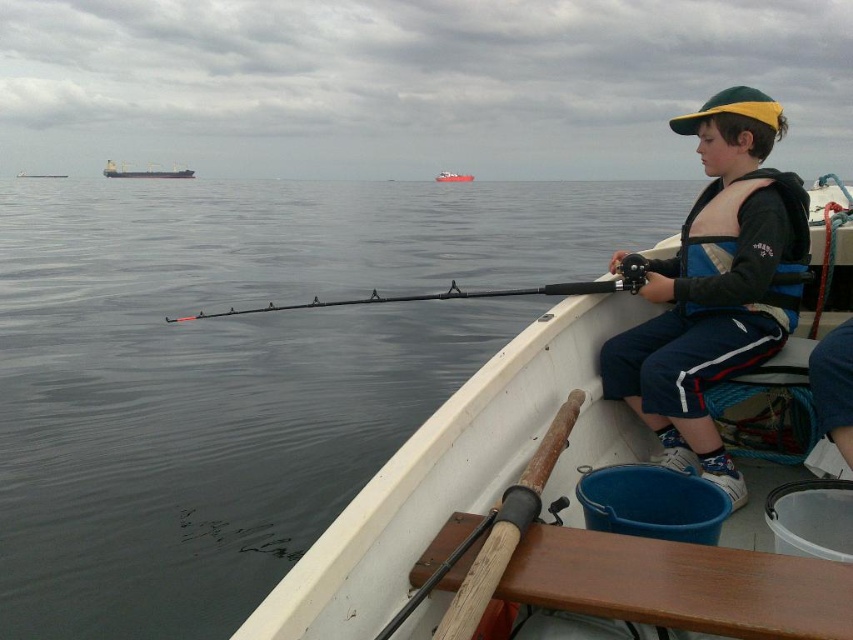
You are standing on the deck of a ship and see a point marked at coordinates point [163,292]. If you want to throw a lifebuoy to that point, and the lifebuoy can travel 10 meters, will it reach the point?

The point [163,292] is 11.82 meters away from the viewer. Since the lifebuoy can only travel 10 meters, it will not reach the point.

In the scene shown: You are a sailor on the metallic gray cargo ship at upper left and want to see the smooth water at center. In which direction should you look from your current position?

You should look downward because the smooth water at center is located below the metallic gray cargo ship at upper left.

You are a sailor standing on the deck of a ship. You see the smooth water at center and the red glossy boat at center. How far apart are these two objects from each other?

The smooth water at center and the red glossy boat at center are 41.79 meters apart from each other.